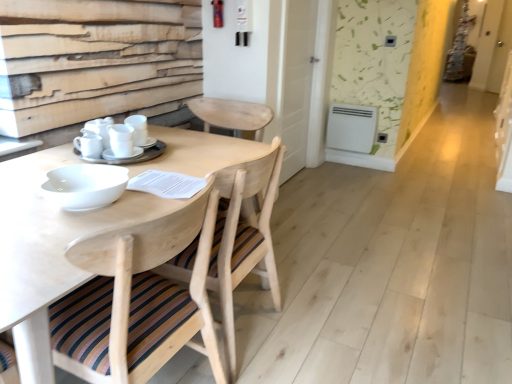
Locate an element on the screen. free space to the left of white glossy cup at center, placed as the 1th tableware when sorted from left to right is located at coordinates (38, 159).